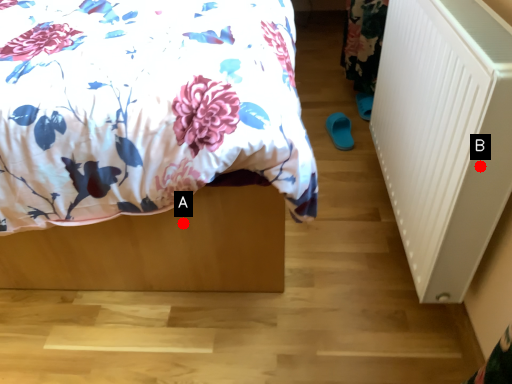
Question: Two points are circled on the image, labeled by A and B beside each circle. Which point is closer to the camera taking this photo?

Choices:
 (A) A is closer
 (B) B is closer

Answer: (B)